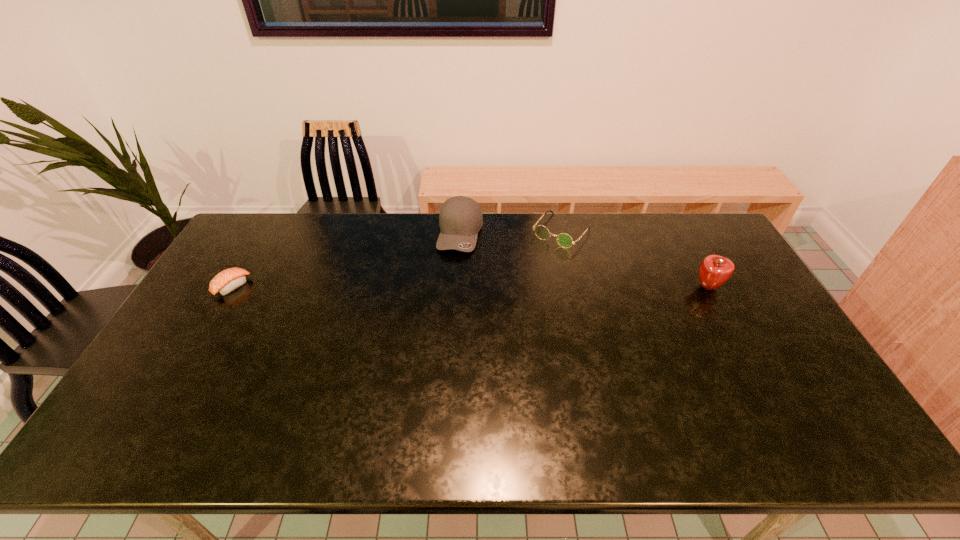
Image resolution: width=960 pixels, height=540 pixels. Identify the location of sushi. (230, 279).

This screenshot has width=960, height=540. In order to click on the shortest object in this screenshot , I will do `click(230, 279)`.

At what (x,y) coordinates should I click in order to perform the action: click on the rightmost object. Please return your answer as a coordinate pair (x, y). The image size is (960, 540). Looking at the image, I should click on (715, 270).

Image resolution: width=960 pixels, height=540 pixels. In order to click on the second object from left to right in this screenshot , I will do `click(460, 219)`.

At what (x,y) coordinates should I click in order to perform the action: click on the third tallest object. Please return your answer as a coordinate pair (x, y). The width and height of the screenshot is (960, 540). Looking at the image, I should click on (564, 240).

Image resolution: width=960 pixels, height=540 pixels. Find the location of `the third object from left to right`. the third object from left to right is located at coordinates (564, 240).

Locate an element on the screen. The image size is (960, 540). blank area located on the front of the sushi is located at coordinates (215, 316).

Find the location of a particular element. This screenshot has width=960, height=540. vacant region located on the back of the apple is located at coordinates (673, 222).

You are a GUI agent. You are given a task and a screenshot of the screen. Output one action in this format:
    pyautogui.click(x=<x>, y=<y>)
    Task: Click on the free space located 0.310m on the front brim of the baseball cap
    The height and width of the screenshot is (540, 960).
    Given the screenshot: What is the action you would take?
    pyautogui.click(x=446, y=326)

Where is `free space located 0.170m on the front brim of the baseball cap`? free space located 0.170m on the front brim of the baseball cap is located at coordinates (452, 292).